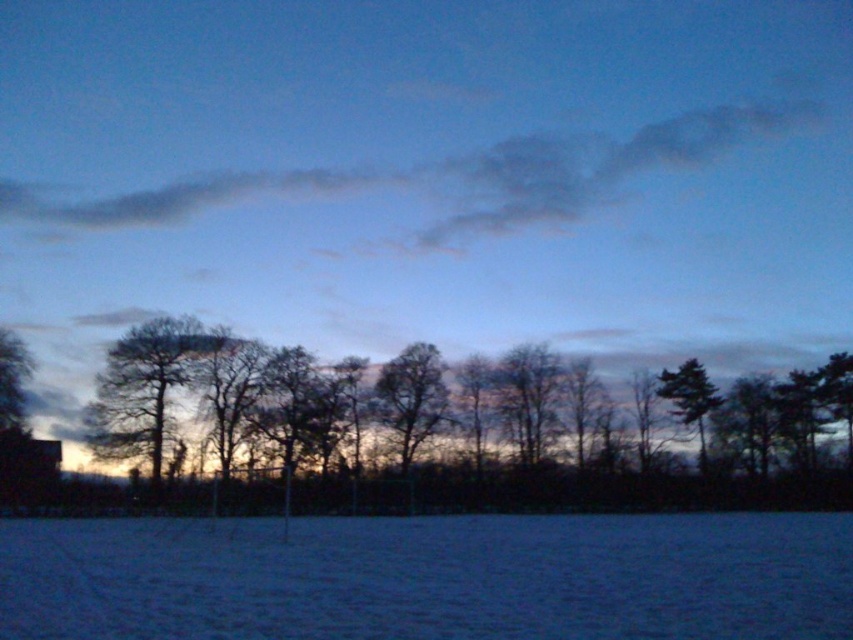
Is dark gray cloud at upper center to the right of silhouette bare tree at left from the viewer's perspective?

Correct, you'll find dark gray cloud at upper center to the right of silhouette bare tree at left.

Is dark gray cloud at upper center behind silhouette bare tree at left?

Yes, dark gray cloud at upper center is further from the viewer.

What do you see at coordinates (451, 179) in the screenshot?
I see `dark gray cloud at upper center` at bounding box center [451, 179].

Identify the location of dark gray cloud at upper center. (451, 179).

Locate an element on the screen. Image resolution: width=853 pixels, height=640 pixels. dark brown tree at center is located at coordinates (465, 426).

In the scene shown: Which is more to the right, dark brown tree at center or dark gray cloud at upper center?

dark brown tree at center

This screenshot has height=640, width=853. I want to click on dark brown tree at center, so 465,426.

Does point (701, 120) come in front of point (660, 384)?

No, (701, 120) is behind (660, 384).

Between dark gray cloud at upper center and green matte tree at right, which one appears on the left side from the viewer's perspective?

Positioned to the left is dark gray cloud at upper center.

Between point (613, 198) and point (688, 362), which one is positioned behind?

Point (613, 198)

Locate an element on the screen. The image size is (853, 640). dark gray cloud at upper center is located at coordinates (451, 179).